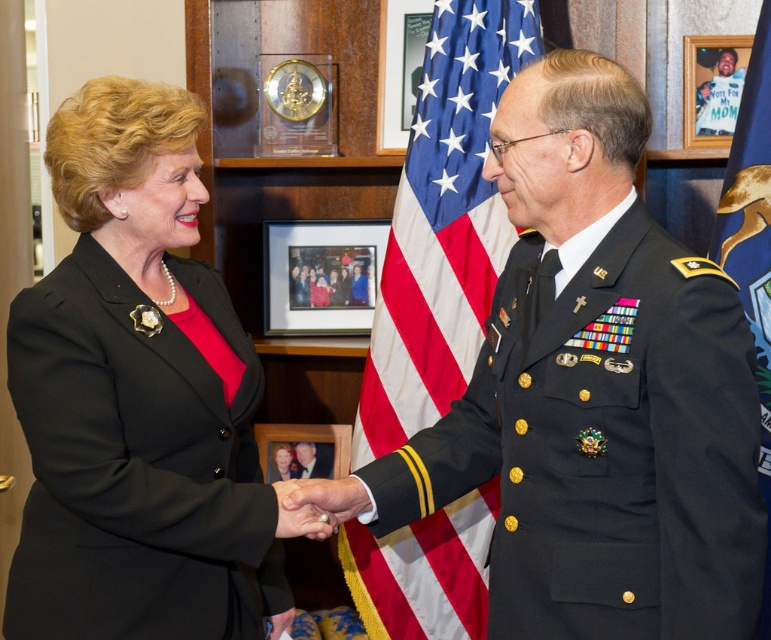
In the scene shown: Can you confirm if blue fabric flag at right is positioned above wooden framed photo at center?

Incorrect, blue fabric flag at right is not positioned above wooden framed photo at center.

Can you confirm if blue fabric flag at right is thinner than wooden framed photo at center?

Yes.

Who is more distant from viewer, (749, 186) or (322, 296)?

Positioned behind is point (322, 296).

This screenshot has width=771, height=640. I want to click on blue fabric flag at right, so click(x=752, y=243).

Can you confirm if black matte uniform at right is smaller than american flag at center?

Incorrect, black matte uniform at right is not smaller in size than american flag at center.

At what (x,y) coordinates should I click in order to perform the action: click on black matte uniform at right. Please return your answer as a coordinate pair (x, y). This screenshot has width=771, height=640. Looking at the image, I should click on (577, 454).

Can you confirm if american flag at center is taller than blue fabric flag at right?

Yes.

Measure the distance between american flag at center and camera.

american flag at center and camera are 2.46 meters apart from each other.

Does point (513, 20) lie in front of point (768, 522)?

No, (513, 20) is behind (768, 522).

Identify the location of american flag at center. (443, 225).